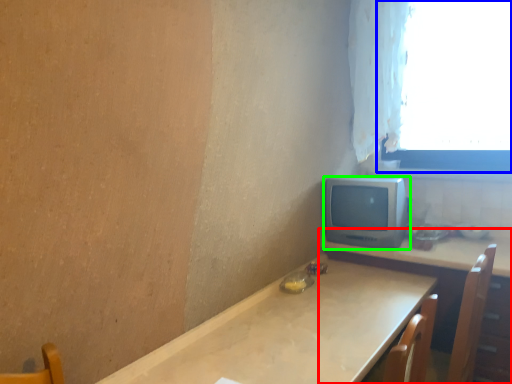
Question: Based on their relative distances, which object is nearer to table (highlighted by a red box)? Choose from window (highlighted by a blue box) and computer monitor (highlighted by a green box).

Choices:
 (A) window
 (B) computer monitor

Answer: (B)